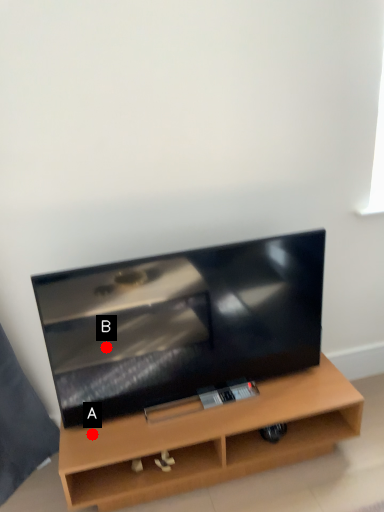
Question: Two points are circled on the image, labeled by A and B beside each circle. Which point is closer to the camera taking this photo?

Choices:
 (A) A is closer
 (B) B is closer

Answer: (B)